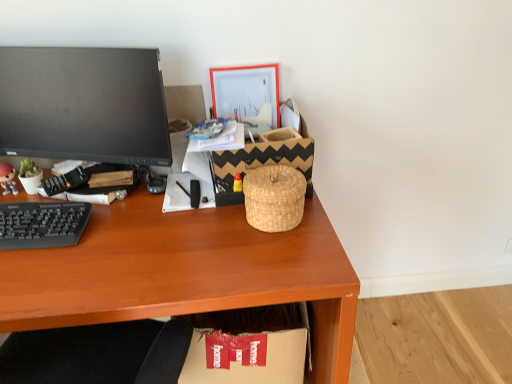
The width and height of the screenshot is (512, 384). What are the coordinates of `free location to the right of black plastic keyboard at left` in the screenshot? It's located at (106, 252).